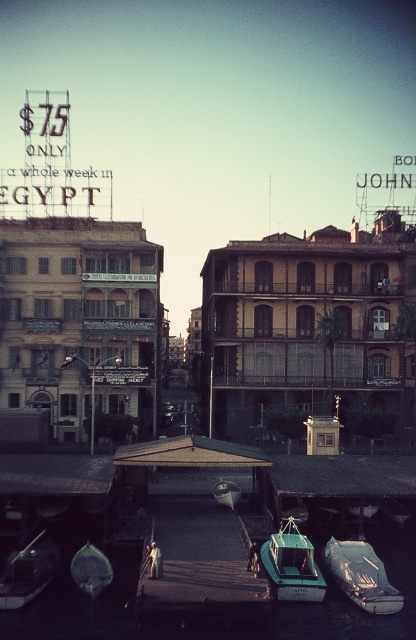
You are standing at the edge of the dock and want to locate the teal matte boat at center. According to the coordinates provided, where would you find it?

The teal matte boat at center is located at the coordinates point (292, 564).

Looking at this image, you are a tour guide leading a group of tourists to the dock. You need to board the largest boat available. Which boat should you choose between the metallic green boat at lower center and the teal glossy boat at center?

The metallic green boat at lower center is larger in size than the teal glossy boat at center, so you should choose the metallic green boat at lower center.